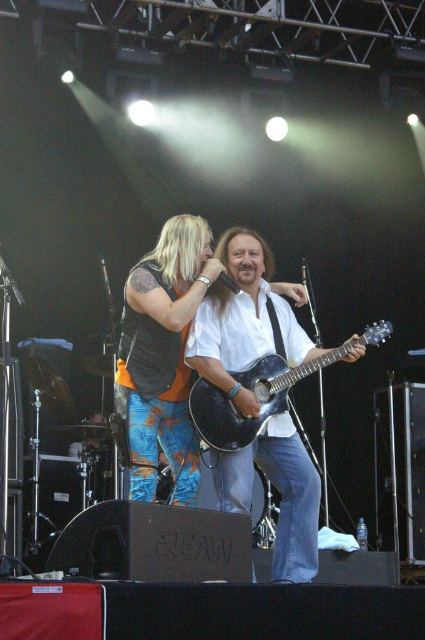
Can you confirm if shiny black guitar at center is positioned above orange printed pants at center?

Actually, shiny black guitar at center is below orange printed pants at center.

Does shiny black guitar at center have a greater width compared to orange printed pants at center?

Yes.

Does point (297, 484) lie in front of point (133, 440)?

No.

This screenshot has width=425, height=640. Find the location of `shiny black guitar at center`. shiny black guitar at center is located at coordinates (243, 321).

Between point (173, 396) and point (277, 403), which one is positioned behind?

The point (277, 403) is more distant.

Who is more forward, [129,410] or [226,397]?

Point [129,410]

Find the location of a particular element. The height and width of the screenshot is (640, 425). orange printed pants at center is located at coordinates (163, 356).

Which is above, shiny black guitar at center or matte black acoustic guitar at center?

matte black acoustic guitar at center

Can you confirm if shiny black guitar at center is positioned below matte black acoustic guitar at center?

Indeed, shiny black guitar at center is positioned under matte black acoustic guitar at center.

Based on the photo, measure the distance between point (292, 493) and camera.

Point (292, 493) is 23.51 feet away from camera.

Identify the location of shiny black guitar at center. (243, 321).